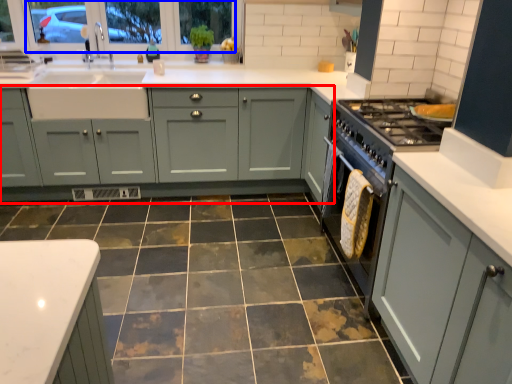
Question: Among these objects, which one is farthest to the camera, cabinetry (highlighted by a red box) or window screen (highlighted by a blue box)?

Choices:
 (A) cabinetry
 (B) window screen

Answer: (B)